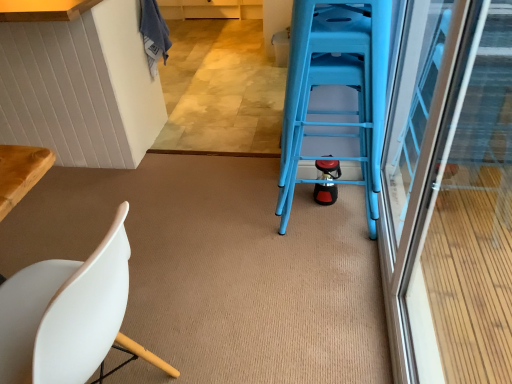
Identify the location of blue plastic ladder at center. The height and width of the screenshot is (384, 512). (337, 84).

Identify the location of transparent glass screen door at right. The image size is (512, 384). (449, 194).

Between white matte chair at lower left and blue plastic ladder at center, which one has larger width?

Wider between the two is white matte chair at lower left.

Are white matte chair at lower left and blue plastic ladder at center beside each other?

No, white matte chair at lower left is not beside blue plastic ladder at center.

From the picture: In terms of height, does white matte chair at lower left look taller or shorter compared to blue plastic ladder at center?

Considering their sizes, white matte chair at lower left has less height than blue plastic ladder at center.

How many degrees apart are the facing directions of blue plastic ladder at center and transparent glass screen door at right?

They differ by 93.2 degrees in their facing directions.

This screenshot has width=512, height=384. In the image, there is a transparent glass screen door at right. In order to click on ladder above it (from the image's perspective) in this screenshot , I will do `click(337, 84)`.

In the scene shown: From a real-world perspective, who is located lower, blue plastic ladder at center or transparent glass screen door at right?

From a 3D spatial view, blue plastic ladder at center is below.

Considering the positions of objects blue plastic ladder at center and transparent glass screen door at right in the image provided, who is in front, blue plastic ladder at center or transparent glass screen door at right?

transparent glass screen door at right is in front.

Is point (367, 183) positioned behind point (6, 363)?

Yes, point (367, 183) is farther from viewer.

Looking at this image, is blue plastic ladder at center not close to white matte chair at lower left?

No, blue plastic ladder at center is not far away from white matte chair at lower left.

From the image's perspective, relative to white matte chair at lower left, is blue plastic ladder at center above or below?

From the image's perspective, blue plastic ladder at center appears above white matte chair at lower left.

Is blue plastic ladder at center wider or thinner than white matte chair at lower left?

In the image, blue plastic ladder at center appears to be more narrow than white matte chair at lower left.

Considering the relative positions of transparent glass screen door at right and white matte chair at lower left in the image provided, is transparent glass screen door at right behind white matte chair at lower left?

No, transparent glass screen door at right is closer to the camera.

Looking at this image, which is more to the left, transparent glass screen door at right or white matte chair at lower left?

white matte chair at lower left.

Who is taller, transparent glass screen door at right or white matte chair at lower left?

Standing taller between the two is transparent glass screen door at right.

Choose the correct answer: Is transparent glass screen door at right inside white matte chair at lower left or outside it?

transparent glass screen door at right cannot be found inside white matte chair at lower left.

From their relative heights in the image, would you say white matte chair at lower left is taller or shorter than transparent glass screen door at right?

Considering their sizes, white matte chair at lower left has less height than transparent glass screen door at right.

Is white matte chair at lower left at the left side of transparent glass screen door at right?

Indeed, white matte chair at lower left is positioned on the left side of transparent glass screen door at right.

Is white matte chair at lower left positioned with its back to transparent glass screen door at right?

Yes, transparent glass screen door at right is at the back of white matte chair at lower left.

From a real-world perspective, is white matte chair at lower left on transparent glass screen door at right?

No.

From a real-world perspective, who is located higher, transparent glass screen door at right or blue plastic ladder at center?

transparent glass screen door at right, from a real-world perspective.

Is transparent glass screen door at right oriented away from blue plastic ladder at center?

Yes, transparent glass screen door at right is facing away from blue plastic ladder at center.

Can you tell me how much transparent glass screen door at right and blue plastic ladder at center differ in facing direction?

The facing directions of transparent glass screen door at right and blue plastic ladder at center are 93.2 degrees apart.

Which is in front, transparent glass screen door at right or blue plastic ladder at center?

transparent glass screen door at right is closer to the camera.

Image resolution: width=512 pixels, height=384 pixels. Identify the location of chair that is on the left side of blue plastic ladder at center. (68, 315).

Where is `ladder that is under the transparent glass screen door at right (from a real-world perspective)`? This screenshot has height=384, width=512. ladder that is under the transparent glass screen door at right (from a real-world perspective) is located at coordinates (x=337, y=84).

When comparing their distances from white matte chair at lower left, does transparent glass screen door at right or blue plastic ladder at center seem further?

transparent glass screen door at right is positioned further to the anchor white matte chair at lower left.

Estimate the real-world distances between objects in this image. Which object is closer to blue plastic ladder at center, transparent glass screen door at right or white matte chair at lower left?

The object closer to blue plastic ladder at center is transparent glass screen door at right.

Which object lies further to the anchor point white matte chair at lower left, blue plastic ladder at center or transparent glass screen door at right?

transparent glass screen door at right is further to white matte chair at lower left.

Consider the image. Looking at the image, which one is located closer to blue plastic ladder at center, white matte chair at lower left or transparent glass screen door at right?

transparent glass screen door at right.

Which object lies nearer to the anchor point transparent glass screen door at right, white matte chair at lower left or blue plastic ladder at center?

The object closer to transparent glass screen door at right is blue plastic ladder at center.

Looking at the image, which one is located closer to transparent glass screen door at right, blue plastic ladder at center or white matte chair at lower left?

The object closer to transparent glass screen door at right is blue plastic ladder at center.

You are a GUI agent. You are given a task and a screenshot of the screen. Output one action in this format:
    pyautogui.click(x=<x>, y=<y>)
    Task: Click on the ladder between white matte chair at lower left and transparent glass screen door at right from left to right
    The width and height of the screenshot is (512, 384).
    Given the screenshot: What is the action you would take?
    pyautogui.click(x=337, y=84)